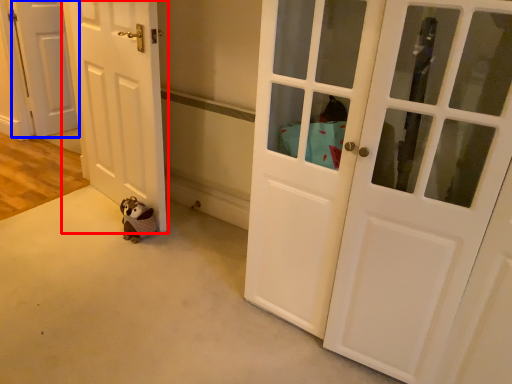
Question: Which of the following is the farthest to the observer, door (highlighted by a red box) or door (highlighted by a blue box)?

Choices:
 (A) door
 (B) door

Answer: (B)